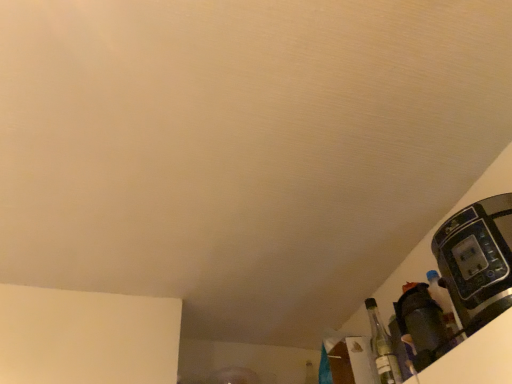
Where is `matte black coffee maker at lower right`? matte black coffee maker at lower right is located at coordinates tap(421, 325).

Locate an element on the screen. black plastic coffee machine at right is located at coordinates (477, 260).

Where is `matte black coffee maker at lower right`? matte black coffee maker at lower right is located at coordinates (421, 325).

Which object is positioned more to the left, black plastic coffee machine at right or matte black coffee maker at lower right?

matte black coffee maker at lower right is more to the left.

What's the angular difference between black plastic coffee machine at right and matte black coffee maker at lower right's facing directions?

They differ by 0.00426 degrees in their facing directions.

Which is behind, point (486, 281) or point (419, 294)?

The point (419, 294) is more distant.

Is black plastic coffee machine at right further to camera compared to matte black coffee maker at lower right?

No, black plastic coffee machine at right is closer to the viewer.

Considering the positions of point (417, 329) and point (394, 364), is point (417, 329) closer or farther from the camera than point (394, 364)?

Clearly, point (417, 329) is closer to the camera than point (394, 364).

Between matte black coffee maker at lower right and clear glass bottle at lower right, which one has larger size?

Bigger between the two is matte black coffee maker at lower right.

From the image's perspective, which object appears higher, matte black coffee maker at lower right or clear glass bottle at lower right?

From the image's view, matte black coffee maker at lower right is above.

Choose the correct answer: Is matte black coffee maker at lower right inside clear glass bottle at lower right or outside it?

matte black coffee maker at lower right cannot be found inside clear glass bottle at lower right.

Between point (490, 282) and point (390, 379), which one is positioned behind?

Point (390, 379)

Could you tell me if black plastic coffee machine at right is turned towards clear glass bottle at lower right?

No, black plastic coffee machine at right does not turn towards clear glass bottle at lower right.

From the image's perspective, is black plastic coffee machine at right above or below clear glass bottle at lower right?

black plastic coffee machine at right is situated higher than clear glass bottle at lower right in the image.

The height and width of the screenshot is (384, 512). Identify the location of bottle above the matte black coffee maker at lower right (from a real-world perspective). (382, 347).

Is clear glass bottle at lower right bigger than matte black coffee maker at lower right?

Actually, clear glass bottle at lower right might be smaller than matte black coffee maker at lower right.

Can you confirm if clear glass bottle at lower right is positioned to the right of matte black coffee maker at lower right?

No.

How different are the orientations of clear glass bottle at lower right and matte black coffee maker at lower right in degrees?

The angle between the facing direction of clear glass bottle at lower right and the facing direction of matte black coffee maker at lower right is 0.00451 degrees.

From a real-world perspective, is clear glass bottle at lower right positioned over black plastic coffee machine at right based on gravity?

Yes.

Does clear glass bottle at lower right touch black plastic coffee machine at right?

There is a gap between clear glass bottle at lower right and black plastic coffee machine at right.

From the image's perspective, is clear glass bottle at lower right above black plastic coffee machine at right?

No, from the image's perspective, clear glass bottle at lower right is not on top of black plastic coffee machine at right.

Which is more to the right, clear glass bottle at lower right or black plastic coffee machine at right?

From the viewer's perspective, black plastic coffee machine at right appears more on the right side.

From the image's perspective, between matte black coffee maker at lower right and black plastic coffee machine at right, which one is located above?

black plastic coffee machine at right appears higher in the image.

Is matte black coffee maker at lower right spatially inside black plastic coffee machine at right, or outside of it?

matte black coffee maker at lower right is not enclosed by black plastic coffee machine at right.

Is matte black coffee maker at lower right far away from black plastic coffee machine at right?

No, there isn't a large distance between matte black coffee maker at lower right and black plastic coffee machine at right.

Image resolution: width=512 pixels, height=384 pixels. What are the coordinates of `coffee machine located in front of the matte black coffee maker at lower right` in the screenshot? It's located at (477, 260).

This screenshot has height=384, width=512. I want to click on bottle below the matte black coffee maker at lower right (from the image's perspective), so (382, 347).

Looking at the image, which one is located further to matte black coffee maker at lower right, black plastic coffee machine at right or clear glass bottle at lower right?

Among the two, black plastic coffee machine at right is located further to matte black coffee maker at lower right.

When comparing their distances from black plastic coffee machine at right, does matte black coffee maker at lower right or clear glass bottle at lower right seem further?

clear glass bottle at lower right.

Estimate the real-world distances between objects in this image. Which object is closer to clear glass bottle at lower right, matte black coffee maker at lower right or black plastic coffee machine at right?

matte black coffee maker at lower right is closer to clear glass bottle at lower right.

When comparing their distances from matte black coffee maker at lower right, does clear glass bottle at lower right or black plastic coffee machine at right seem closer?

clear glass bottle at lower right lies closer to matte black coffee maker at lower right than the other object.

Based on the photo, when comparing their distances from black plastic coffee machine at right, does clear glass bottle at lower right or matte black coffee maker at lower right seem further?

clear glass bottle at lower right is further to black plastic coffee machine at right.

From the image, which object appears to be nearer to clear glass bottle at lower right, black plastic coffee machine at right or matte black coffee maker at lower right?

Based on the image, matte black coffee maker at lower right appears to be nearer to clear glass bottle at lower right.

The image size is (512, 384). In order to click on appliance positioned between black plastic coffee machine at right and clear glass bottle at lower right from near to far in this screenshot , I will do `click(421, 325)`.